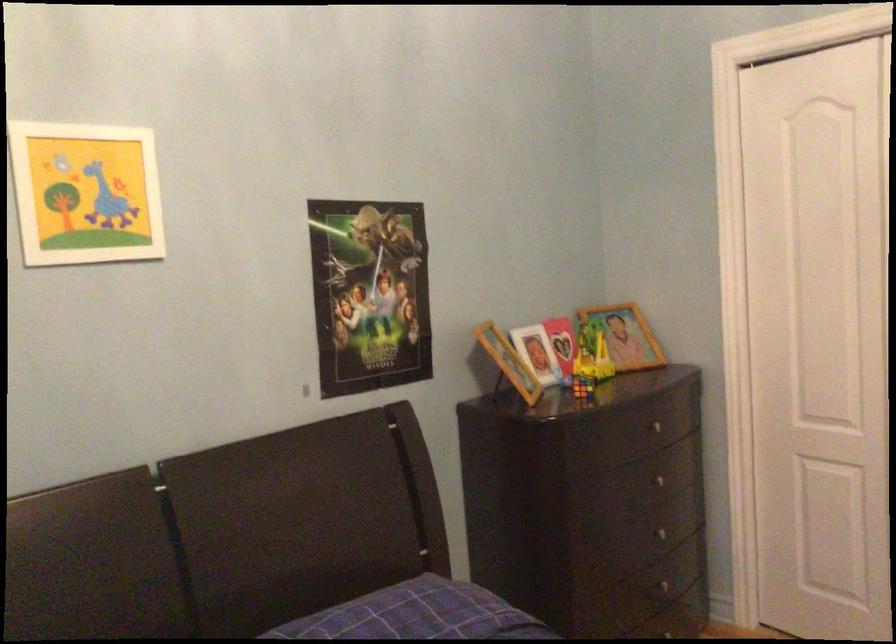
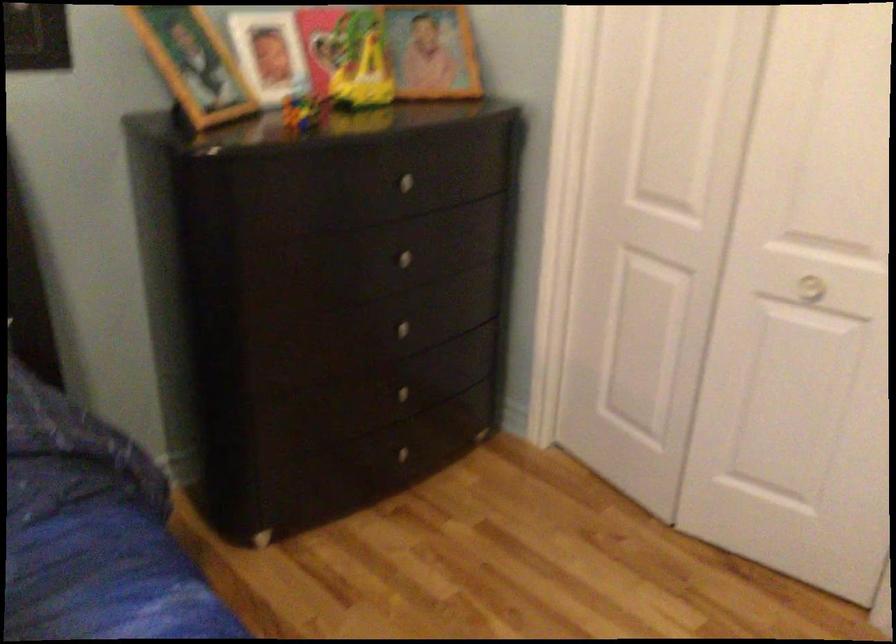
Locate, in the second image, the point that corresponds to pixel 589 386 in the first image.

(303, 111)